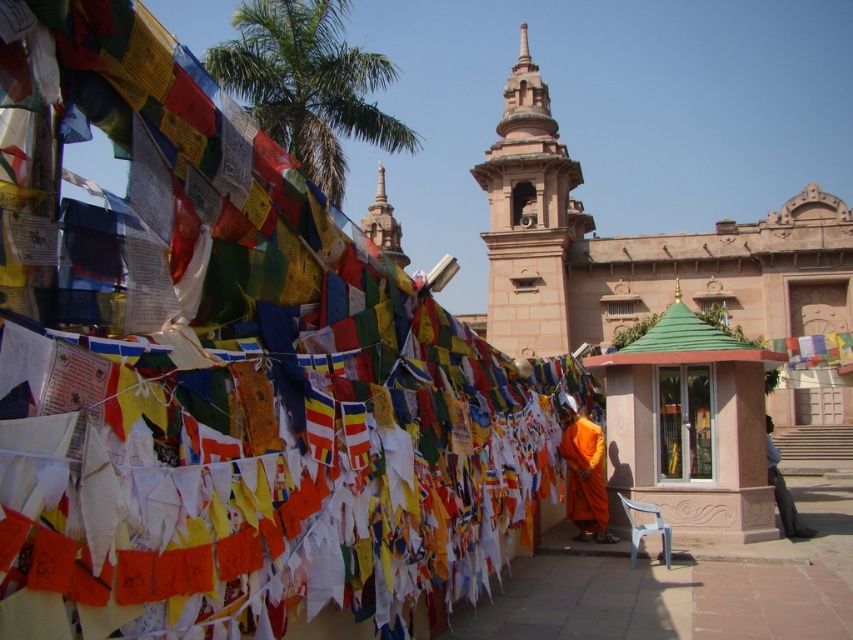
Question: Which point is farther to the camera?

Choices:
 (A) orange silk robe at center
 (B) green leafy palm tree at upper center

Answer: (B)

Question: Which point appears closest to the camera in this image?

Choices:
 (A) (788, 532)
 (B) (328, 131)
 (C) (514, 97)
 (D) (577, 481)

Answer: (A)

Question: Which of the following is the closest to the observer?

Choices:
 (A) (564, 227)
 (B) (364, 72)
 (C) (805, 531)
 (D) (381, 216)

Answer: (C)

Question: From the image, what is the correct spatial relationship of beige stone tower at center in relation to orange silk robe at center?

Choices:
 (A) below
 (B) above

Answer: (B)

Question: Can you confirm if green leafy palm tree at upper center is wider than orange cloth at lower right?

Choices:
 (A) yes
 (B) no

Answer: (A)

Question: Does green leafy palm tree at upper center have a greater width compared to beige stone tower at center?

Choices:
 (A) no
 (B) yes

Answer: (B)